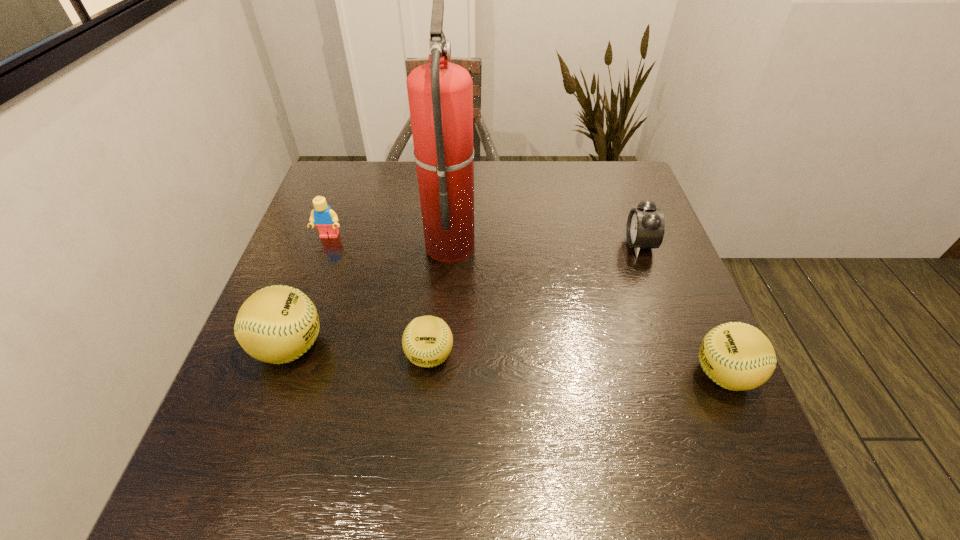
In order to click on free area in between the alarm clock and the Lego in this screenshot , I will do `click(484, 240)`.

Where is `empty space that is in between the tallest softball and the tallest object`? empty space that is in between the tallest softball and the tallest object is located at coordinates (370, 295).

You are a GUI agent. You are given a task and a screenshot of the screen. Output one action in this format:
    pyautogui.click(x=<x>, y=<y>)
    Task: Click on the vacant point located between the fire extinguisher and the alarm clock
    Image resolution: width=960 pixels, height=540 pixels.
    Given the screenshot: What is the action you would take?
    tap(544, 244)

Locate an element on the screen. blank region between the rightmost softball and the leftmost softball is located at coordinates (507, 361).

Identify the location of empty location between the fire extinguisher and the Lego. (390, 240).

I want to click on vacant space in between the Lego and the tallest softball, so click(x=310, y=292).

Identify the location of vacant space that is in between the Lego and the rightmost softball. (526, 306).

Identify which object is located as the fourth nearest to the Lego. Please provide its 2D coordinates. Your answer should be formatted as a tuple, i.e. [(x, y)], where the tuple contains the x and y coordinates of a point satisfying the conditions above.

[(645, 228)]

You are a GUI agent. You are given a task and a screenshot of the screen. Output one action in this format:
    pyautogui.click(x=<x>, y=<y>)
    Task: Click on the object that stands as the third closest to the fire extinguisher
    This screenshot has width=960, height=540.
    Given the screenshot: What is the action you would take?
    277,324

This screenshot has height=540, width=960. I want to click on the closest softball relative to the rightmost softball, so click(427, 341).